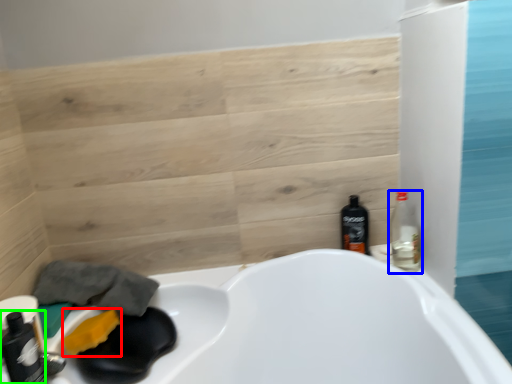
Question: Which object is the farthest from soap (highlighted by a red box)? Choose among these: bottle (highlighted by a blue box) or bottle (highlighted by a green box).

Choices:
 (A) bottle
 (B) bottle

Answer: (A)